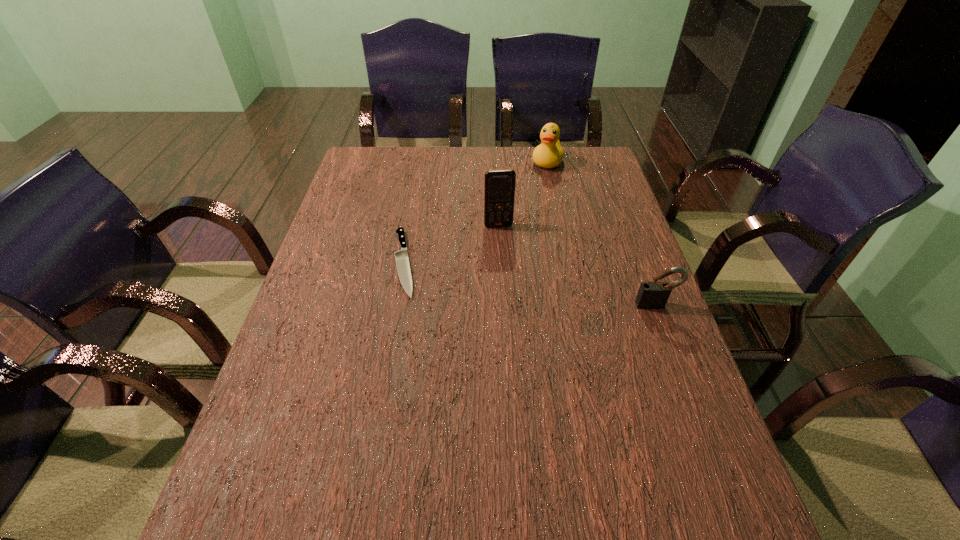
Where is `free space located on the screen of the cellular telephone`? The image size is (960, 540). free space located on the screen of the cellular telephone is located at coordinates (505, 253).

Locate an element on the screen. This screenshot has height=540, width=960. free spot located 0.050m on the screen of the cellular telephone is located at coordinates (502, 239).

Locate an element on the screen. free location located on the screen of the cellular telephone is located at coordinates (512, 286).

Locate an element on the screen. Image resolution: width=960 pixels, height=540 pixels. vacant position located at the beak of the duck is located at coordinates (525, 211).

Find the location of a particular element. This screenshot has height=540, width=960. free space located 0.290m at the beak of the duck is located at coordinates (521, 220).

You are a GUI agent. You are given a task and a screenshot of the screen. Output one action in this format:
    pyautogui.click(x=<x>, y=<y>)
    Task: Click on the free space located 0.080m at the beak of the duck
    
    Given the screenshot: What is the action you would take?
    pyautogui.click(x=538, y=184)

Where is `object positioned at the far edge`? The image size is (960, 540). object positioned at the far edge is located at coordinates (549, 154).

Identify the location of padlock that is at the right edge. (651, 295).

Identify the location of duck that is at the right edge. (549, 154).

Identify the location of object at the far right corner. The image size is (960, 540). (549, 154).